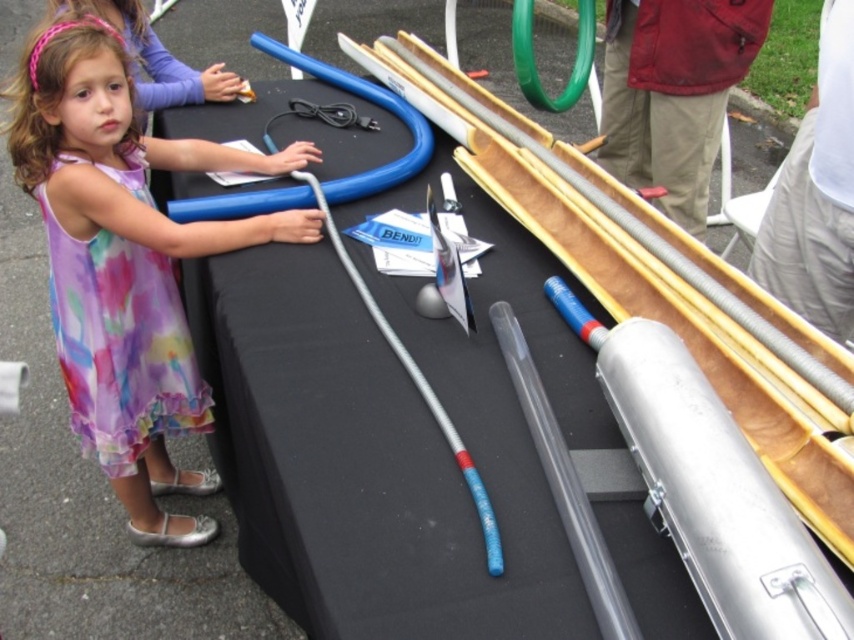
Can you confirm if black fabric table at center is positioned above matte purple dress at center?

Yes.

Who is shorter, black fabric table at center or matte purple dress at center?

With less height is matte purple dress at center.

Is point (375, 552) in front of point (311, 160)?

Yes.

This screenshot has width=854, height=640. What are the coordinates of `black fabric table at center` in the screenshot? It's located at (392, 435).